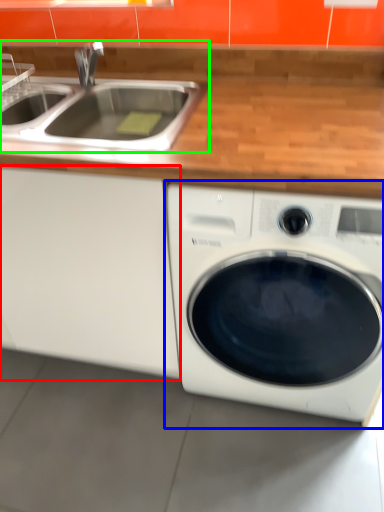
Question: Which is nearer to the cabinetry (highlighted by a red box)? washing machine (highlighted by a blue box) or sink (highlighted by a green box).

Choices:
 (A) washing machine
 (B) sink

Answer: (A)